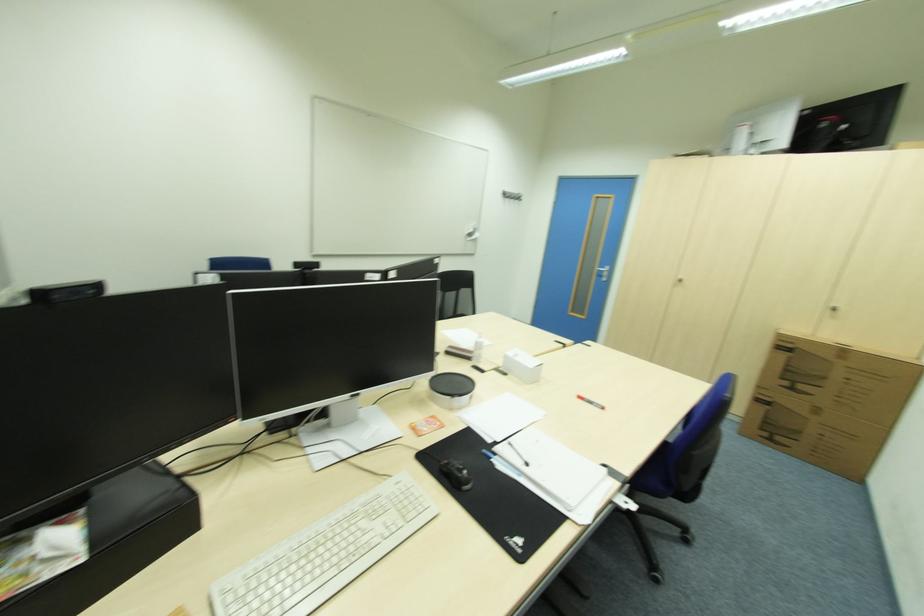
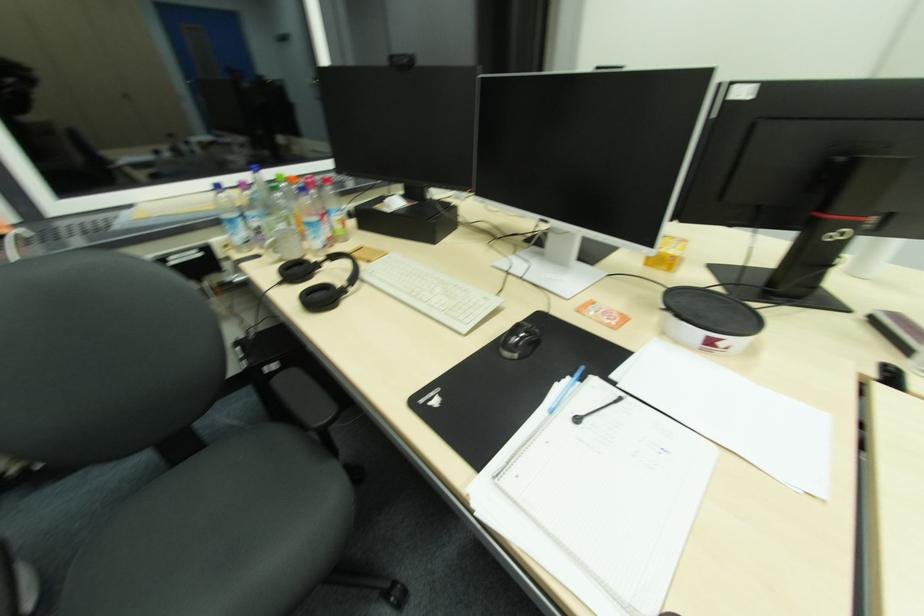
The first image is from the beginning of the video and the second image is from the end. How did the camera likely rotate when shooting the video?

The camera rotated toward left-down.